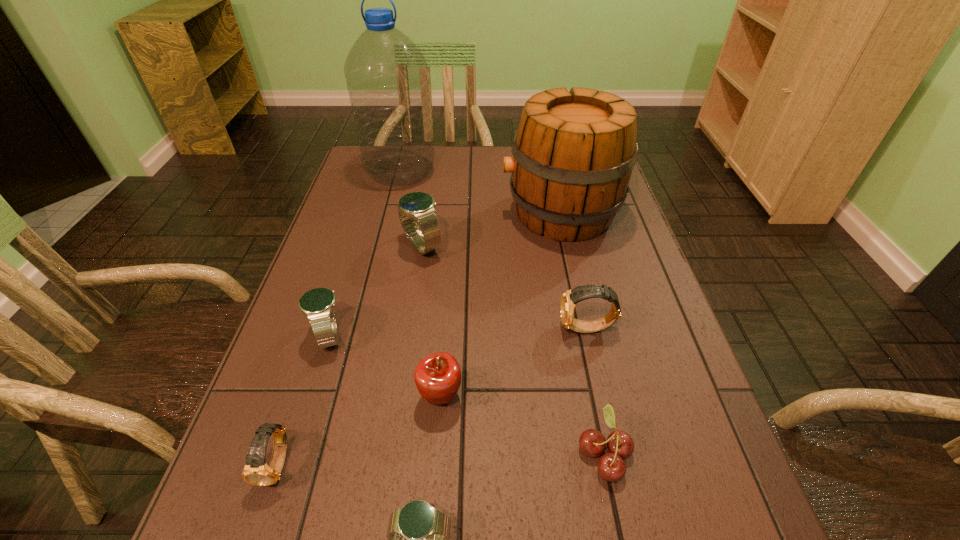
Locate an element on the screen. The image size is (960, 540). free location located on the face of the rightmost watch is located at coordinates (459, 329).

Where is `vacant region located on the right of the second biggest blue watch`? vacant region located on the right of the second biggest blue watch is located at coordinates (468, 335).

At what (x,y) coordinates should I click in order to perform the action: click on vacant space situated on the front of the fourth nearest object. Please return your answer as a coordinate pair (x, y). Image resolution: width=960 pixels, height=540 pixels. Looking at the image, I should click on (431, 524).

You are a GUI agent. You are given a task and a screenshot of the screen. Output one action in this format:
    pyautogui.click(x=<x>, y=<y>)
    Task: Click on the free region located 0.330m on the leaves of the red cherry
    This screenshot has width=960, height=540.
    Given the screenshot: What is the action you would take?
    pyautogui.click(x=387, y=453)

The width and height of the screenshot is (960, 540). In order to click on free location located 0.340m on the leaves of the red cherry in this screenshot , I will do `click(381, 453)`.

Locate an element on the screen. Image resolution: width=960 pixels, height=540 pixels. blank space located 0.360m on the leaves of the red cherry is located at coordinates (370, 453).

The height and width of the screenshot is (540, 960). In order to click on free space located 0.060m on the face of the second nearest watch in this screenshot , I will do pyautogui.click(x=256, y=532).

The width and height of the screenshot is (960, 540). Identify the location of water jug located at the far edge. (387, 79).

This screenshot has height=540, width=960. In order to click on cider situated at the far edge in this screenshot , I will do click(x=574, y=151).

The height and width of the screenshot is (540, 960). What are the coordinates of `water jug that is at the left edge` in the screenshot? It's located at (387, 79).